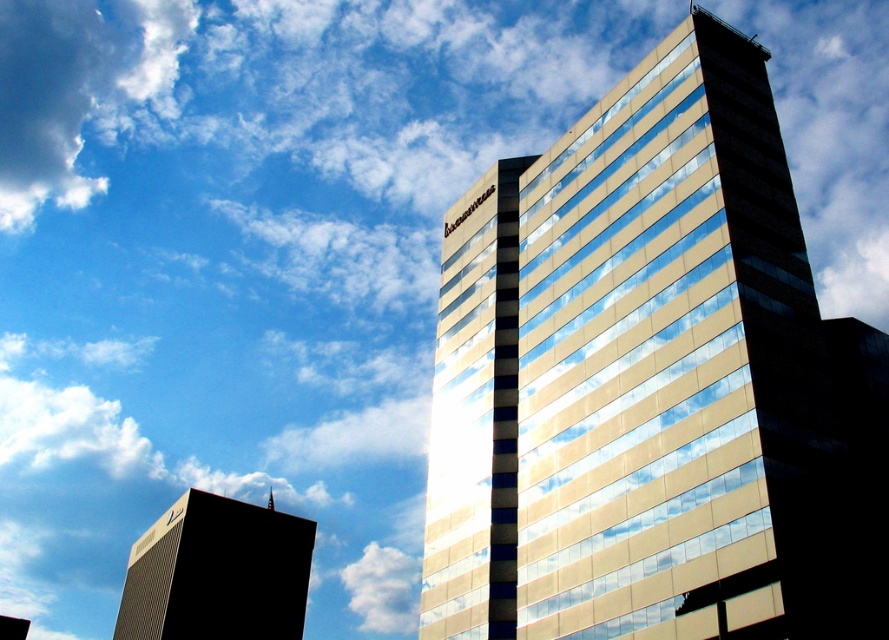
In the scene shown: You are standing in the middle of the urban landscape and want to walk towards the point that is closer to the foreground. Which point should you head towards, point (x=707, y=74) or point (x=73, y=131)?

Point (x=707, y=74) is in front of point (x=73, y=131), so you should head towards point (x=707, y=74) as it is closer to the foreground.

You are standing in the city square and want to take a photo of both the gold reflective glass building at center and the black glass tower at lower left. Which building should you move closer to in order to include both in your frame without zooming?

You should move closer to the black glass tower at lower left because the gold reflective glass building at center is closer to the viewer, so moving towards the farther black glass tower at lower left will help balance their sizes in the photo frame.